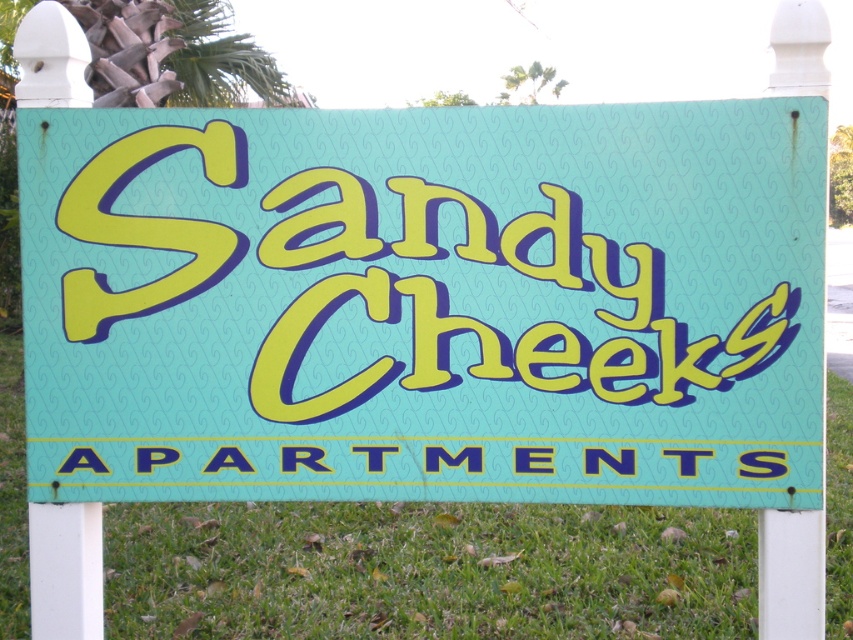
Question: Which is farther from the teal matte signboard at center?

Choices:
 (A) green grass at center
 (B) blue plastic text at center

Answer: (A)

Question: Is teal matte signboard at center in front of green grass at center?

Choices:
 (A) no
 (B) yes

Answer: (B)

Question: Which of the following is the farthest from the observer?

Choices:
 (A) blue plastic text at center
 (B) teal matte signboard at center

Answer: (A)

Question: Among these objects, which one is farthest from the camera?

Choices:
 (A) green grass at center
 (B) blue plastic text at center
 (C) teal matte signboard at center

Answer: (A)

Question: Is teal matte signboard at center to the left of green grass at center from the viewer's perspective?

Choices:
 (A) no
 (B) yes

Answer: (A)

Question: Can you confirm if teal matte signboard at center is positioned to the right of green grass at center?

Choices:
 (A) no
 (B) yes

Answer: (B)